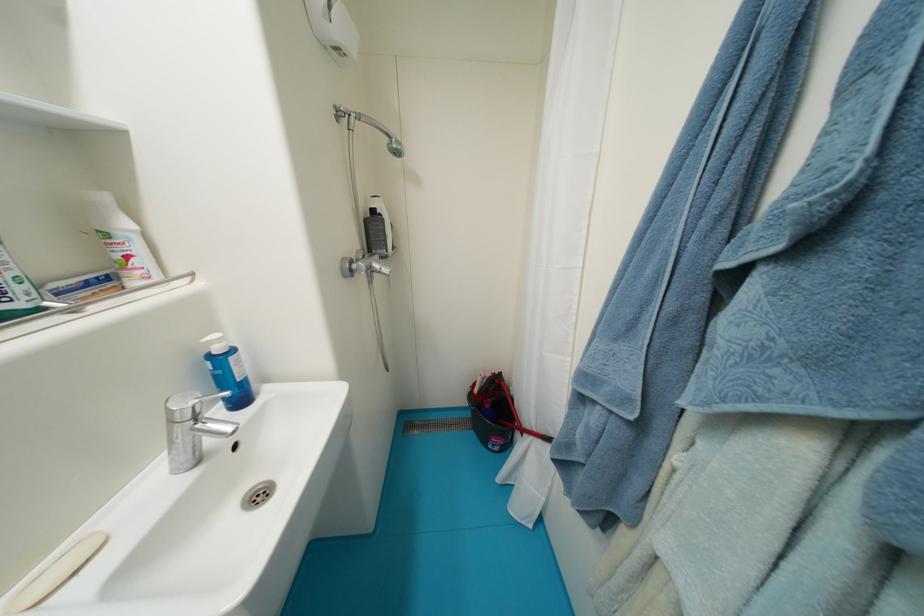
The height and width of the screenshot is (616, 924). What do you see at coordinates (81, 286) in the screenshot?
I see `the small cardboard box` at bounding box center [81, 286].